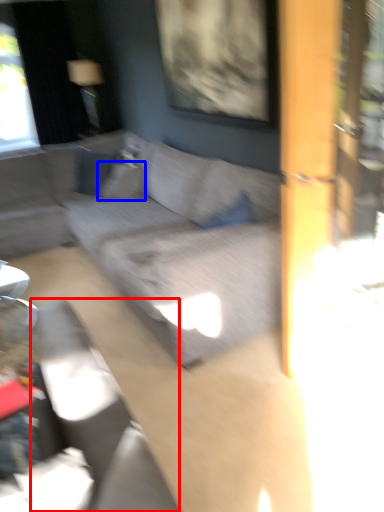
Question: Which object is closer to the camera taking this photo, swivel chair (highlighted by a red box) or pillow (highlighted by a blue box)?

Choices:
 (A) swivel chair
 (B) pillow

Answer: (A)